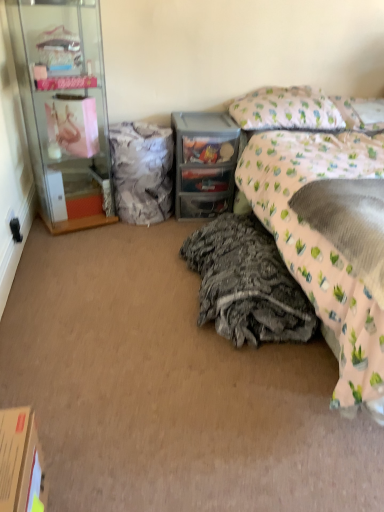
The width and height of the screenshot is (384, 512). Find the location of `vacant space that's between clear glass cabinet at left and cardboard box at lower left`. vacant space that's between clear glass cabinet at left and cardboard box at lower left is located at coordinates (57, 316).